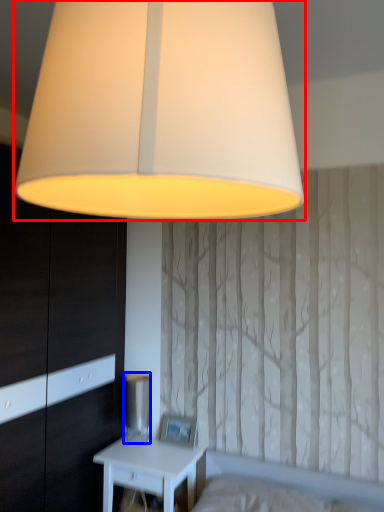
Question: Which point is further to the camera, lamp (highlighted by a red box) or table lamp (highlighted by a blue box)?

Choices:
 (A) lamp
 (B) table lamp

Answer: (B)